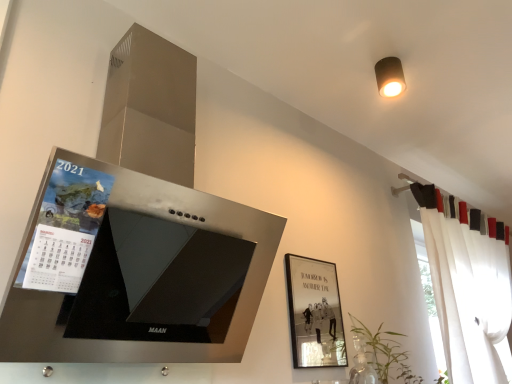
The image size is (512, 384). Find the location of `matte paper calendar at left`. matte paper calendar at left is located at coordinates (x=65, y=228).

What do you see at coordinates (65, 228) in the screenshot? I see `matte paper calendar at left` at bounding box center [65, 228].

The height and width of the screenshot is (384, 512). What do you see at coordinates (389, 76) in the screenshot? I see `matte brown cylindrical light fixture at upper right` at bounding box center [389, 76].

Measure the distance between clear glass vase at lower right and camera.

clear glass vase at lower right is 5.17 feet from camera.

Where is `clear glass vase at lower right`? clear glass vase at lower right is located at coordinates (362, 364).

At what (x,y) coordinates should I click in order to perform the action: click on matte black picture frame at center-right. Please return your answer as a coordinate pair (x, y). This screenshot has width=512, height=384. Looking at the image, I should click on click(x=314, y=313).

Find the location of a particular element. The width and height of the screenshot is (512, 384). green leafy plant at lower right is located at coordinates (385, 353).

Does green leafy plant at lower right have a greater width compared to clear glass vase at lower right?

Correct, the width of green leafy plant at lower right exceeds that of clear glass vase at lower right.

From the image's perspective, who appears lower, green leafy plant at lower right or clear glass vase at lower right?

clear glass vase at lower right appears lower in the image.

Does point (377, 340) come behind point (360, 337)?

No.

Between green leafy plant at lower right and clear glass vase at lower right, which one is positioned in front?

green leafy plant at lower right is more forward.

Considering the sizes of matte black picture frame at center-right and green leafy plant at lower right in the image, is matte black picture frame at center-right bigger or smaller than green leafy plant at lower right?

Clearly, matte black picture frame at center-right is smaller in size than green leafy plant at lower right.

Is point (291, 331) closer to viewer compared to point (407, 353)?

Yes, point (291, 331) is closer to viewer.

How far apart are matte black picture frame at center-right and green leafy plant at lower right?

matte black picture frame at center-right and green leafy plant at lower right are 24.44 centimeters apart.

Is matte black picture frame at center-right next to green leafy plant at lower right?

No, matte black picture frame at center-right is not next to green leafy plant at lower right.

Is green leafy plant at lower right oriented away from matte brown cylindrical light fixture at upper right?

No, green leafy plant at lower right is not facing away from matte brown cylindrical light fixture at upper right.

Based on the photo, is green leafy plant at lower right completely or partially outside of matte brown cylindrical light fixture at upper right?

Yes.

The width and height of the screenshot is (512, 384). In order to click on light fixture behind the green leafy plant at lower right in this screenshot , I will do `click(389, 76)`.

Which object is positioned more to the left, green leafy plant at lower right or matte brown cylindrical light fixture at upper right?

green leafy plant at lower right is more to the left.

From the image's perspective, is clear glass vase at lower right under green leafy plant at lower right?

Indeed, from the image's perspective, clear glass vase at lower right is shown beneath green leafy plant at lower right.

Does point (352, 382) appear closer or farther from the camera than point (370, 349)?

Point (352, 382) appears to be closer to the viewer than point (370, 349).

Is clear glass vase at lower right far from green leafy plant at lower right?

Actually, clear glass vase at lower right and green leafy plant at lower right are a little close together.

Does clear glass vase at lower right have a greater width compared to green leafy plant at lower right?

In fact, clear glass vase at lower right might be narrower than green leafy plant at lower right.

Does clear glass vase at lower right have a greater height compared to matte black picture frame at center-right?

In fact, clear glass vase at lower right may be shorter than matte black picture frame at center-right.

From a real-world perspective, is clear glass vase at lower right located higher than matte black picture frame at center-right?

No, from a real-world perspective, clear glass vase at lower right is not above matte black picture frame at center-right.

Between point (366, 368) and point (301, 256), which one is positioned in front?

The point (301, 256) is closer.

Are matte black picture frame at center-right and matte brown cylindrical light fixture at upper right far apart?

matte black picture frame at center-right is actually quite close to matte brown cylindrical light fixture at upper right.

Which of these two, matte black picture frame at center-right or matte brown cylindrical light fixture at upper right, stands shorter?

With less height is matte brown cylindrical light fixture at upper right.

Could you measure the distance between matte black picture frame at center-right and matte brown cylindrical light fixture at upper right?

35.93 inches.

Between matte black picture frame at center-right and matte brown cylindrical light fixture at upper right, which one has smaller size?

matte brown cylindrical light fixture at upper right.

Looking at the image, does matte brown cylindrical light fixture at upper right seem bigger or smaller compared to white sheer curtain at right?

Considering their sizes, matte brown cylindrical light fixture at upper right takes up less space than white sheer curtain at right.

Is matte brown cylindrical light fixture at upper right to the left of white sheer curtain at right from the viewer's perspective?

Yes, matte brown cylindrical light fixture at upper right is to the left of white sheer curtain at right.

Identify the location of curtain that is under the matte brown cylindrical light fixture at upper right (from a real-world perspective). This screenshot has width=512, height=384. (467, 297).

Where is `glass vase below the green leafy plant at lower right (from the image's perspective)`? glass vase below the green leafy plant at lower right (from the image's perspective) is located at coordinates (362, 364).

I want to click on plant behind the matte black picture frame at center-right, so click(385, 353).

Consider the image. Looking at the image, which one is located further to matte paper calendar at left, matte brown cylindrical light fixture at upper right or white sheer curtain at right?

white sheer curtain at right is further to matte paper calendar at left.

Considering their positions, is matte paper calendar at left positioned further to matte black picture frame at center-right than matte brown cylindrical light fixture at upper right?

matte paper calendar at left is positioned further to the anchor matte black picture frame at center-right.

Estimate the real-world distances between objects in this image. Which object is closer to matte paper calendar at left, white sheer curtain at right or matte brown cylindrical light fixture at upper right?

matte brown cylindrical light fixture at upper right is positioned closer to the anchor matte paper calendar at left.

Looking at the image, which one is located further to matte brown cylindrical light fixture at upper right, white sheer curtain at right or matte paper calendar at left?

matte paper calendar at left is further to matte brown cylindrical light fixture at upper right.

Which object lies further to the anchor point matte brown cylindrical light fixture at upper right, matte black picture frame at center-right or white sheer curtain at right?

The object further to matte brown cylindrical light fixture at upper right is white sheer curtain at right.

Estimate the real-world distances between objects in this image. Which object is further from green leafy plant at lower right, matte brown cylindrical light fixture at upper right or matte paper calendar at left?

matte paper calendar at left.

From the image, which object appears to be farther from green leafy plant at lower right, matte black picture frame at center-right or matte brown cylindrical light fixture at upper right?

matte brown cylindrical light fixture at upper right.

Estimate the real-world distances between objects in this image. Which object is further from green leafy plant at lower right, matte paper calendar at left or matte black picture frame at center-right?

matte paper calendar at left is further to green leafy plant at lower right.

Where is `plant between matte paper calendar at left and white sheer curtain at right`? plant between matte paper calendar at left and white sheer curtain at right is located at coordinates (385, 353).

Where is `glass vase between matte black picture frame at center-right and white sheer curtain at right in the horizontal direction`? glass vase between matte black picture frame at center-right and white sheer curtain at right in the horizontal direction is located at coordinates (362, 364).

Identify the location of glass vase located between matte black picture frame at center-right and green leafy plant at lower right in the left-right direction. The height and width of the screenshot is (384, 512). (362, 364).

Where is `light fixture located between matte black picture frame at center-right and white sheer curtain at right in the left-right direction`? The width and height of the screenshot is (512, 384). light fixture located between matte black picture frame at center-right and white sheer curtain at right in the left-right direction is located at coordinates (389, 76).